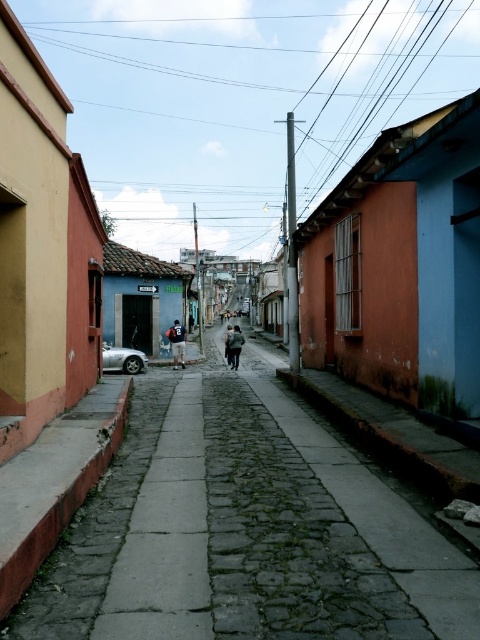
Does gray cobblestone pavement at center have a lesser width compared to silver metallic car at left?

Incorrect, gray cobblestone pavement at center's width is not less than silver metallic car at left's.

Between gray cobblestone pavement at center and silver metallic car at left, which one appears on the right side from the viewer's perspective?

From the viewer's perspective, gray cobblestone pavement at center appears more on the right side.

Image resolution: width=480 pixels, height=640 pixels. What are the coordinates of `gray cobblestone pavement at center` in the screenshot? It's located at (x=245, y=531).